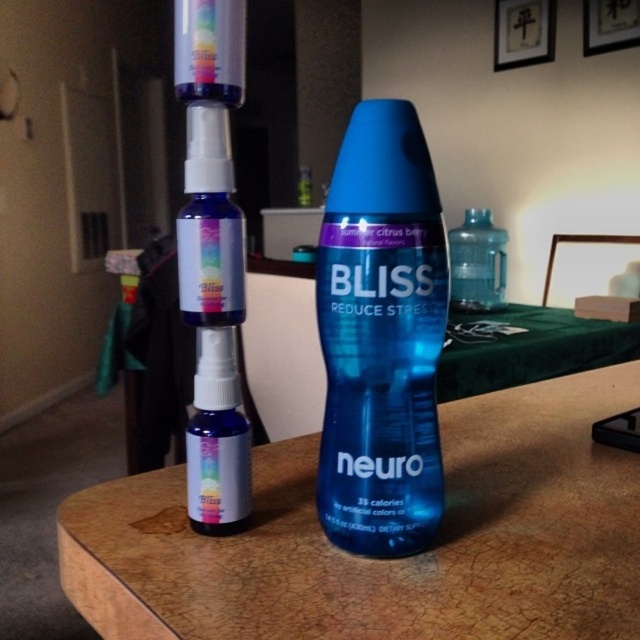
Question: Which point is farther to the camera?

Choices:
 (A) transparent plastic water bottle at center
 (B) blue glossy bottle at center

Answer: (A)

Question: Among these points, which one is nearest to the camera?

Choices:
 (A) (388, 234)
 (B) (492, 253)
 (C) (214, 333)
 (D) (300, 205)

Answer: (A)

Question: Which object is farther from the camera taking this photo?

Choices:
 (A) blue matte spray bottle at center
 (B) blue glossy bottle at center
 (C) matte glass spray bottle at center

Answer: (A)

Question: Does matte plastic table at center have a greater width compared to matte glass spray bottle at center?

Choices:
 (A) yes
 (B) no

Answer: (A)

Question: Does blue glossy bottle at center have a smaller size compared to blue matte spray bottle at center?

Choices:
 (A) no
 (B) yes

Answer: (B)

Question: Does blue glossy bottle at center appear under transparent plastic water bottle at center?

Choices:
 (A) yes
 (B) no

Answer: (A)